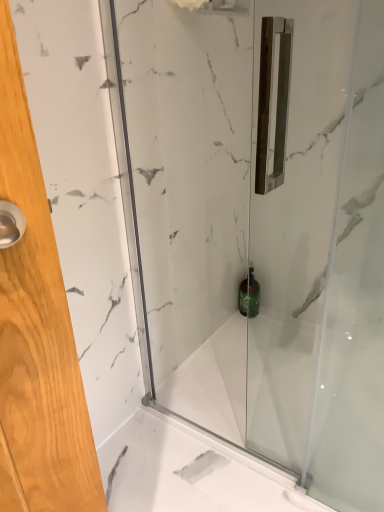
Question: In terms of height, does green glass bottle at center look taller or shorter compared to transparent glass shower door at center?

Choices:
 (A) tall
 (B) short

Answer: (B)

Question: Is green glass bottle at center in front of or behind transparent glass shower door at center in the image?

Choices:
 (A) front
 (B) behind

Answer: (B)

Question: From the image's perspective, is green glass bottle at center located above or below transparent glass shower door at center?

Choices:
 (A) above
 (B) below

Answer: (B)

Question: Considering the positions of transparent glass shower door at center and green glass bottle at center in the image, is transparent glass shower door at center taller or shorter than green glass bottle at center?

Choices:
 (A) short
 (B) tall

Answer: (B)

Question: Is point pyautogui.click(x=306, y=488) positioned closer to the camera than point pyautogui.click(x=241, y=293)?

Choices:
 (A) closer
 (B) farther

Answer: (A)

Question: Considering the positions of transparent glass shower door at center and green glass bottle at center in the image, is transparent glass shower door at center wider or thinner than green glass bottle at center?

Choices:
 (A) thin
 (B) wide

Answer: (A)

Question: Is transparent glass shower door at center in front of or behind green glass bottle at center in the image?

Choices:
 (A) behind
 (B) front

Answer: (B)